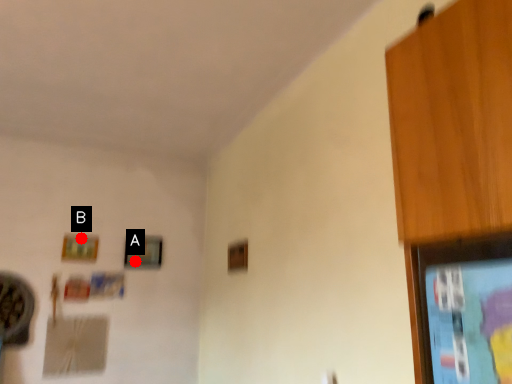
Question: Two points are circled on the image, labeled by A and B beside each circle. Which of the following is the closest to the observer?

Choices:
 (A) A is closer
 (B) B is closer

Answer: (B)